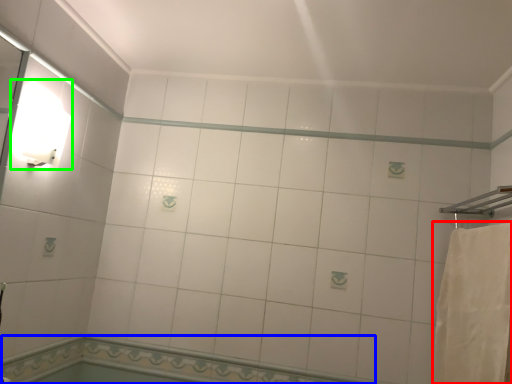
Question: Considering the real-world distances, which object is closest to bath towel (highlighted by a red box)? bath (highlighted by a blue box) or light fixture (highlighted by a green box).

Choices:
 (A) bath
 (B) light fixture

Answer: (A)